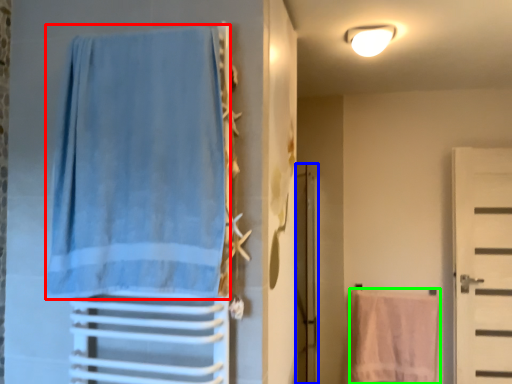
Question: Which object is positioned closest to curtain (highlighted by a red box)? Select from screen door (highlighted by a blue box) and beach towel (highlighted by a green box).

Choices:
 (A) screen door
 (B) beach towel

Answer: (A)